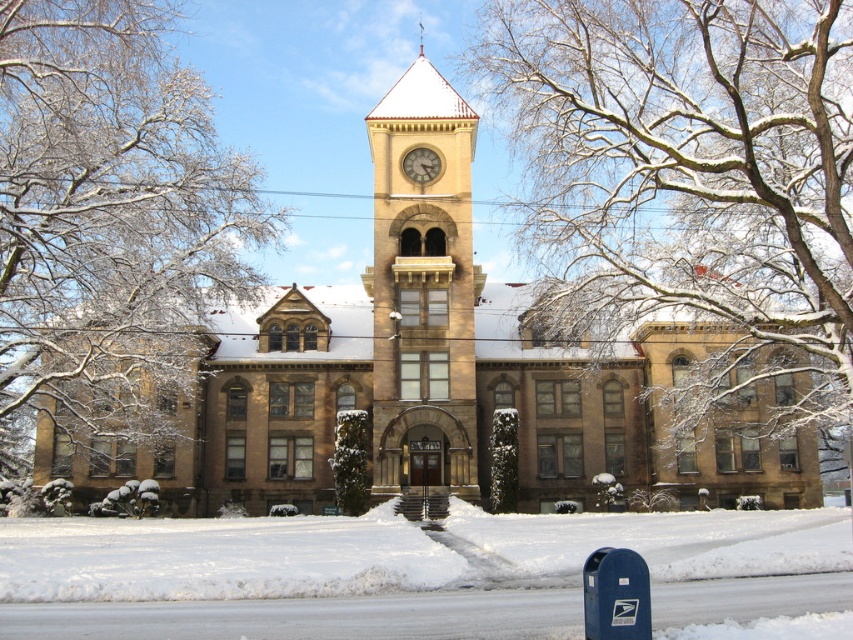
In the scene shown: Does brown stone church at center lie in front of snow-covered branches at upper left?

No.

Who is more forward, [668,465] or [84,314]?

Point [84,314]

Locate an element on the screen. This screenshot has height=640, width=853. brown stone church at center is located at coordinates (450, 369).

Can you confirm if brown stone church at center is smaller than snow-covered branches at upper center?

No, brown stone church at center is not smaller than snow-covered branches at upper center.

Looking at this image, does brown stone church at center have a lesser width compared to snow-covered branches at upper center?

Incorrect, brown stone church at center's width is not less than snow-covered branches at upper center's.

Image resolution: width=853 pixels, height=640 pixels. What do you see at coordinates (450, 369) in the screenshot?
I see `brown stone church at center` at bounding box center [450, 369].

Where is `brown stone church at center`? The image size is (853, 640). brown stone church at center is located at coordinates (450, 369).

Which is more to the left, brown stone clock tower at center or matte brown clock at center?

Positioned to the left is matte brown clock at center.

Is brown stone clock tower at center above matte brown clock at center?

No, brown stone clock tower at center is not above matte brown clock at center.

Where is `brown stone clock tower at center`? brown stone clock tower at center is located at coordinates (422, 289).

In order to click on brown stone clock tower at center in this screenshot , I will do `click(422, 289)`.